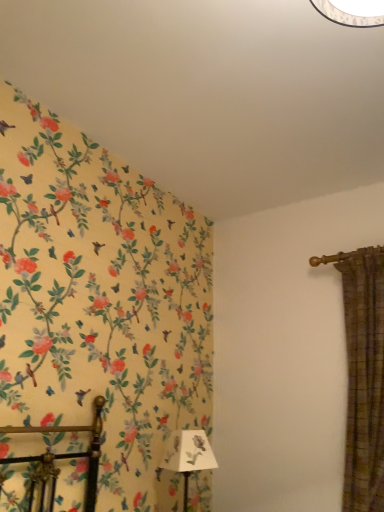
Question: Can you confirm if white paper lampshade at lower center is bigger than green plaid curtain at right?

Choices:
 (A) yes
 (B) no

Answer: (B)

Question: Can you confirm if white paper lampshade at lower center is positioned to the right of green plaid curtain at right?

Choices:
 (A) no
 (B) yes

Answer: (A)

Question: Is white paper lampshade at lower center closer to the viewer compared to green plaid curtain at right?

Choices:
 (A) yes
 (B) no

Answer: (B)

Question: Can you confirm if white paper lampshade at lower center is smaller than green plaid curtain at right?

Choices:
 (A) yes
 (B) no

Answer: (A)

Question: Considering the relative sizes of white paper lampshade at lower center and green plaid curtain at right in the image provided, is white paper lampshade at lower center shorter than green plaid curtain at right?

Choices:
 (A) yes
 (B) no

Answer: (A)

Question: Can we say white paper lampshade at lower center lies outside green plaid curtain at right?

Choices:
 (A) no
 (B) yes

Answer: (B)

Question: Is green plaid curtain at right to the right of white paper lampshade at lower center from the viewer's perspective?

Choices:
 (A) no
 (B) yes

Answer: (B)

Question: Is green plaid curtain at right looking in the opposite direction of white paper lampshade at lower center?

Choices:
 (A) no
 (B) yes

Answer: (A)

Question: Considering the relative sizes of green plaid curtain at right and white paper lampshade at lower center in the image provided, is green plaid curtain at right wider than white paper lampshade at lower center?

Choices:
 (A) no
 (B) yes

Answer: (B)

Question: From a real-world perspective, is green plaid curtain at right on top of white paper lampshade at lower center?

Choices:
 (A) yes
 (B) no

Answer: (A)

Question: Is green plaid curtain at right positioned far away from white paper lampshade at lower center?

Choices:
 (A) yes
 (B) no

Answer: (B)

Question: Does green plaid curtain at right have a greater height compared to white paper lampshade at lower center?

Choices:
 (A) yes
 (B) no

Answer: (A)

Question: Considering the positions of white paper lampshade at lower center and green plaid curtain at right in the image, is white paper lampshade at lower center taller or shorter than green plaid curtain at right?

Choices:
 (A) tall
 (B) short

Answer: (B)